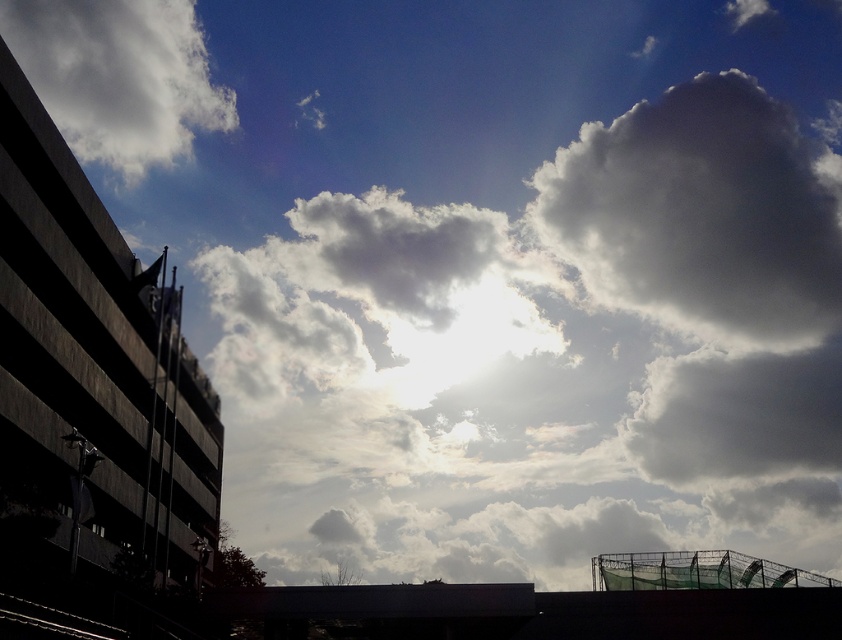
Question: Based on their relative distances, which object is nearer to the white fluffy cloud at upper right?

Choices:
 (A) white fluffy cloud at upper left
 (B) green netting at lower right
 (C) white fluffy cloud at upper center

Answer: (C)

Question: Can you confirm if white fluffy cloud at upper center is smaller than white fluffy cloud at upper left?

Choices:
 (A) yes
 (B) no

Answer: (B)

Question: Does white fluffy cloud at upper center have a lesser width compared to white fluffy cloud at upper left?

Choices:
 (A) no
 (B) yes

Answer: (A)

Question: Considering the real-world distances, which object is closest to the white fluffy cloud at upper center?

Choices:
 (A) white fluffy cloud at upper left
 (B) green netting at lower right
 (C) white fluffy cloud at upper right

Answer: (C)

Question: Among these points, which one is nearest to the camera?

Choices:
 (A) (142, 77)
 (B) (739, 564)
 (C) (350, 436)

Answer: (B)

Question: Can you confirm if white fluffy cloud at upper right is thinner than white fluffy cloud at upper left?

Choices:
 (A) no
 (B) yes

Answer: (A)